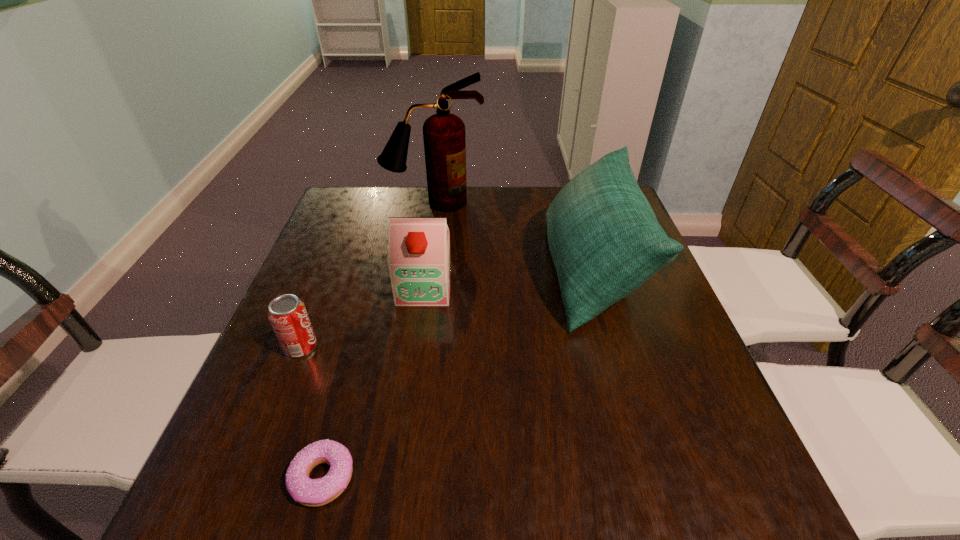
Where is `soda can positioned at the left edge`? The width and height of the screenshot is (960, 540). soda can positioned at the left edge is located at coordinates (289, 319).

Find the location of a particular element. doughnut positioned at the left edge is located at coordinates (310, 492).

Locate an element on the screen. object located at the right edge is located at coordinates (605, 241).

Find the location of a particular element. This screenshot has width=960, height=540. object that is positioned at the far left corner is located at coordinates (444, 138).

Locate an element on the screen. object that is at the near left corner is located at coordinates (310, 492).

Where is `object that is at the far right corner`? object that is at the far right corner is located at coordinates (605, 241).

In the image, there is a desktop. Where is `vacant space at the far edge`? The height and width of the screenshot is (540, 960). vacant space at the far edge is located at coordinates (491, 187).

I want to click on free location at the near edge, so click(x=632, y=492).

Locate an element on the screen. The width and height of the screenshot is (960, 540). free space at the left edge is located at coordinates (290, 375).

In the image, there is a desktop. What are the coordinates of `free space at the far left corner` in the screenshot? It's located at (382, 206).